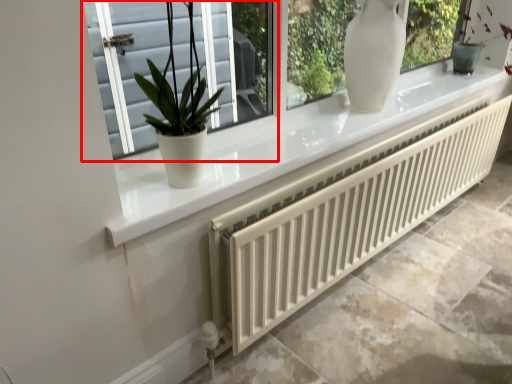
Question: From the image's perspective, considering the relative positions of window (annotated by the red box) and radiator in the image provided, where is window (annotated by the red box) located with respect to the staircase?

Choices:
 (A) above
 (B) below

Answer: (A)